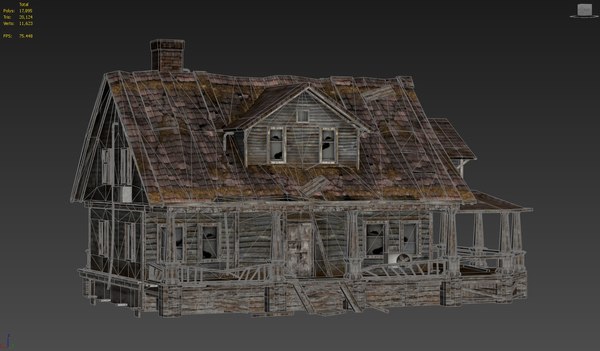
This screenshot has width=600, height=351. I want to click on windows, so click(x=105, y=240), click(x=105, y=177), click(x=121, y=170), click(x=183, y=245), click(x=207, y=243), click(x=326, y=148), click(x=281, y=149), click(x=418, y=250), click(x=375, y=249).